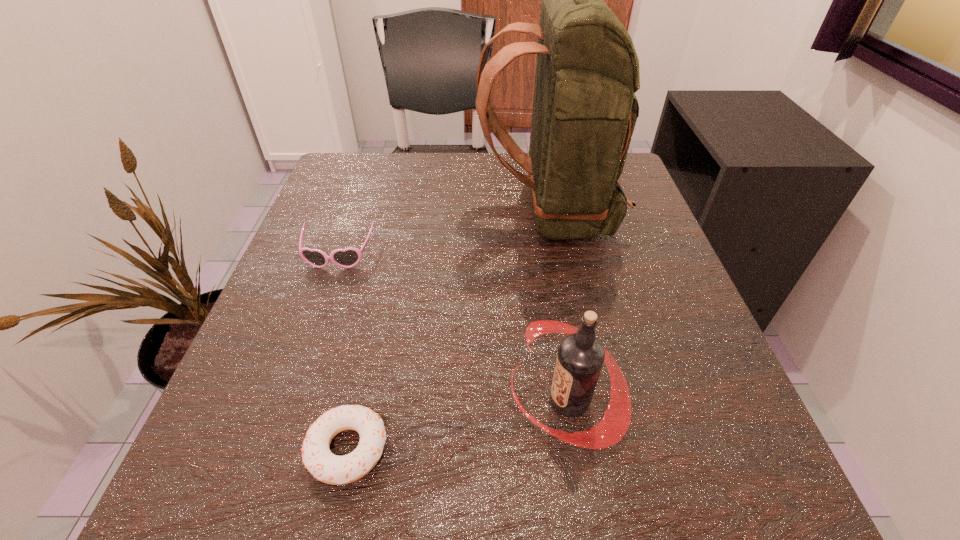
The height and width of the screenshot is (540, 960). What are the coordinates of `object present at the far right corner` in the screenshot? It's located at (584, 113).

The height and width of the screenshot is (540, 960). Identify the location of object at the near right corner. (580, 357).

In the image, there is a desktop. Where is `vacant area at the far edge`? This screenshot has width=960, height=540. vacant area at the far edge is located at coordinates (397, 199).

In order to click on free space at the left edge of the desktop in this screenshot , I will do `click(263, 447)`.

In the image, there is a desktop. Find the location of `vacant space at the right edge`. vacant space at the right edge is located at coordinates (718, 392).

In the image, there is a desktop. At what (x,y) coordinates should I click in order to perform the action: click on vacant space at the far right corner. Please return your answer as a coordinate pair (x, y). Looking at the image, I should click on point(624,171).

At what (x,y) coordinates should I click in order to perform the action: click on blank space at the near right corner. Please return your answer as a coordinate pair (x, y). The width and height of the screenshot is (960, 540). Looking at the image, I should click on (739, 514).

The height and width of the screenshot is (540, 960). What are the coordinates of `empty space that is in between the doughnut and the backpack` in the screenshot? It's located at (447, 330).

The width and height of the screenshot is (960, 540). I want to click on vacant point located between the third shortest object and the third tallest object, so click(x=453, y=328).

Locate an element on the screen. The width and height of the screenshot is (960, 540). free area in between the second tallest object and the backpack is located at coordinates (558, 307).